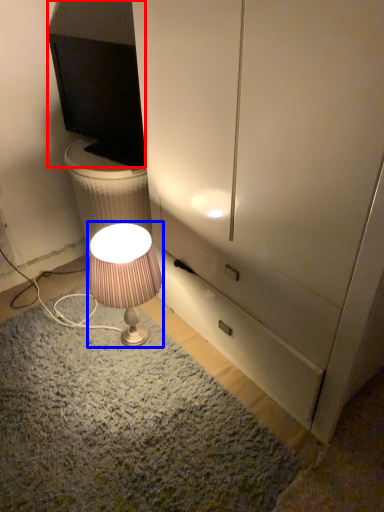
Question: Which point is further to the camera, television (highlighted by a red box) or lamp (highlighted by a blue box)?

Choices:
 (A) television
 (B) lamp

Answer: (A)